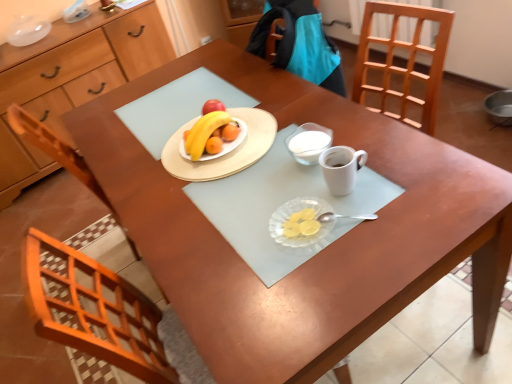
The height and width of the screenshot is (384, 512). In order to click on free spot to the right of white matte coffee cup at center in this screenshot , I will do pos(404,168).